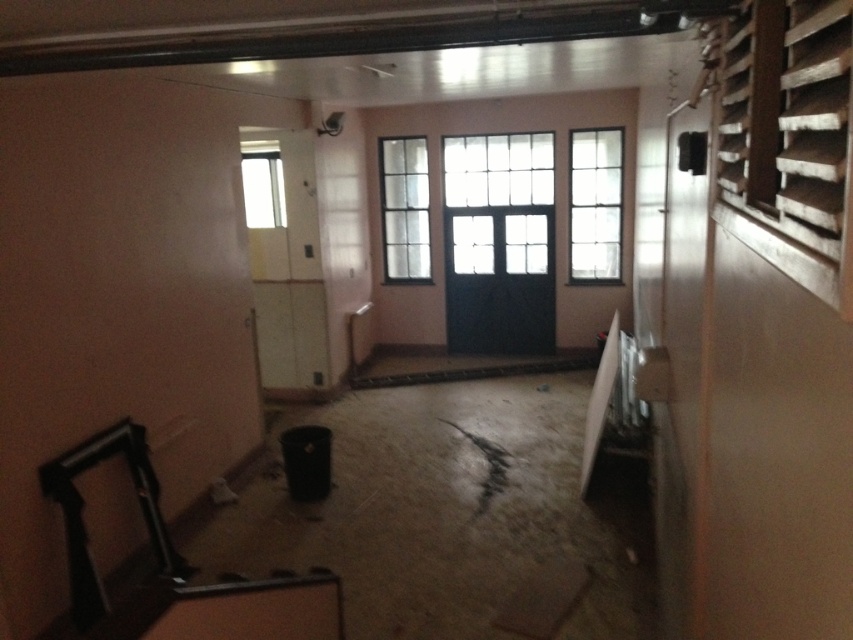
You are a painter hired to assess the walls in this room. The client wants to know if the black matte door at center and the clear glass window at upper center are positioned in a way that might affect the wall painting project. Specifically, do either of these objects block the painter from accessing any areas of the wall that need repainting?

The black matte door at center is larger in size than the clear glass window at upper center. Since the door is larger, it may block a greater portion of the wall, making those areas behind it inaccessible for painting. The window, being smaller, would block less area. However, both objects could potentially obstruct parts of the wall depending on their exact placement and the painting method used.

You are a delivery person entering through the white glossy door at center. You notice a clear glass window at upper center. Which object is wider when viewed from the doorway?

The white glossy door at center is wider than the clear glass window at upper center.

You are standing in a dimly lit room with a white glossy door at center and a clear glass window at upper center. Which object is positioned higher up in the room?

The clear glass window at upper center is positioned higher up in the room than the white glossy door at center.